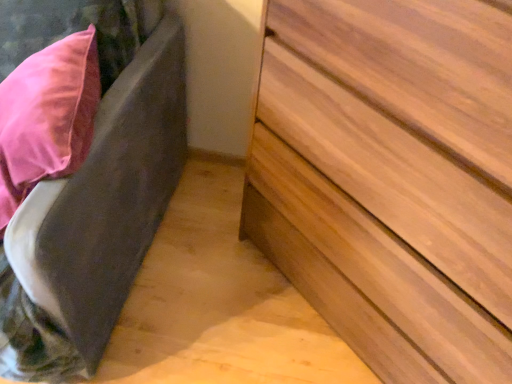
Image resolution: width=512 pixels, height=384 pixels. What do you see at coordinates (96, 209) in the screenshot?
I see `velvet gray bed frame at left` at bounding box center [96, 209].

Locate an element on the screen. velvet gray bed frame at left is located at coordinates (96, 209).

At what (x,y) coordinates should I click in order to perform the action: click on light brown wood chest of drawers at lower right. Please return your answer as a coordinate pair (x, y). The width and height of the screenshot is (512, 384). Looking at the image, I should click on (391, 179).

Measure the distance between light brown wood chest of drawers at lower right and camera.

20.68 inches.

Image resolution: width=512 pixels, height=384 pixels. Describe the element at coordinates (391, 179) in the screenshot. I see `light brown wood chest of drawers at lower right` at that location.

What is the approximate height of light brown wood chest of drawers at lower right?

light brown wood chest of drawers at lower right is 38.69 inches tall.

The width and height of the screenshot is (512, 384). What are the coordinates of `velvet gray bed frame at left` in the screenshot? It's located at (96, 209).

Visually, is velvet gray bed frame at left positioned to the left or to the right of light brown wood chest of drawers at lower right?

velvet gray bed frame at left is to the left of light brown wood chest of drawers at lower right.

In the scene shown: Which object is closer to the camera taking this photo, velvet gray bed frame at left or light brown wood chest of drawers at lower right?

Positioned in front is light brown wood chest of drawers at lower right.

Which is less distant, (64, 339) or (414, 290)?

Point (414, 290)

From the image's perspective, which is above, velvet gray bed frame at left or light brown wood chest of drawers at lower right?

velvet gray bed frame at left, from the image's perspective.

From a real-world perspective, does velvet gray bed frame at left sit lower than light brown wood chest of drawers at lower right?

Yes, from a real-world perspective, velvet gray bed frame at left is below light brown wood chest of drawers at lower right.

Between velvet gray bed frame at left and light brown wood chest of drawers at lower right, which one has larger width?

Wider between the two is velvet gray bed frame at left.

Considering the sizes of velvet gray bed frame at left and light brown wood chest of drawers at lower right in the image, is velvet gray bed frame at left taller or shorter than light brown wood chest of drawers at lower right?

Clearly, velvet gray bed frame at left is shorter compared to light brown wood chest of drawers at lower right.

Can you confirm if velvet gray bed frame at left is smaller than light brown wood chest of drawers at lower right?

Incorrect, velvet gray bed frame at left is not smaller in size than light brown wood chest of drawers at lower right.

Do you think velvet gray bed frame at left is within light brown wood chest of drawers at lower right, or outside of it?

velvet gray bed frame at left cannot be found inside light brown wood chest of drawers at lower right.

Are velvet gray bed frame at left and light brown wood chest of drawers at lower right located far from each other?

No, there isn't a large distance between velvet gray bed frame at left and light brown wood chest of drawers at lower right.

Looking at this image, is velvet gray bed frame at left oriented away from light brown wood chest of drawers at lower right?

That's not correct — velvet gray bed frame at left is not looking away from light brown wood chest of drawers at lower right.

How many degrees apart are the facing directions of velvet gray bed frame at left and light brown wood chest of drawers at lower right?

42.8 degrees separate the facing orientations of velvet gray bed frame at left and light brown wood chest of drawers at lower right.

I want to click on the chest of drawers located below the velvet gray bed frame at left (from the image's perspective), so click(391, 179).

Based on their positions, is light brown wood chest of drawers at lower right located to the left or right of velvet gray bed frame at left?

light brown wood chest of drawers at lower right is to the right of velvet gray bed frame at left.

In the image, is light brown wood chest of drawers at lower right positioned in front of or behind velvet gray bed frame at left?

light brown wood chest of drawers at lower right is in front of velvet gray bed frame at left.

Is point (398, 112) closer to camera compared to point (22, 320)?

Yes, point (398, 112) is closer to viewer.

From the image's perspective, is light brown wood chest of drawers at lower right under velvet gray bed frame at left?

Yes, from the image's perspective, light brown wood chest of drawers at lower right is below velvet gray bed frame at left.

From the picture: From a real-world perspective, does light brown wood chest of drawers at lower right stand above velvet gray bed frame at left?

Indeed, from a real-world perspective, light brown wood chest of drawers at lower right stands above velvet gray bed frame at left.

From the picture: Considering the relative sizes of light brown wood chest of drawers at lower right and velvet gray bed frame at left in the image provided, is light brown wood chest of drawers at lower right thinner than velvet gray bed frame at left?

Yes.

Who is shorter, light brown wood chest of drawers at lower right or velvet gray bed frame at left?

Standing shorter between the two is velvet gray bed frame at left.

Based on their sizes in the image, would you say light brown wood chest of drawers at lower right is bigger or smaller than velvet gray bed frame at left?

Considering their sizes, light brown wood chest of drawers at lower right takes up less space than velvet gray bed frame at left.

Which is correct: light brown wood chest of drawers at lower right is inside velvet gray bed frame at left, or outside of it?

The correct answer is: outside.

Are light brown wood chest of drawers at lower right and velvet gray bed frame at left beside each other?

light brown wood chest of drawers at lower right is not next to velvet gray bed frame at left, and they're not touching.

Is light brown wood chest of drawers at lower right turned away from velvet gray bed frame at left?

That's not correct — light brown wood chest of drawers at lower right is not looking away from velvet gray bed frame at left.

How different are the orientations of light brown wood chest of drawers at lower right and velvet gray bed frame at left in degrees?

42.8 degrees separate the facing orientations of light brown wood chest of drawers at lower right and velvet gray bed frame at left.

Image resolution: width=512 pixels, height=384 pixels. In order to click on the chest of drawers in front of the velvet gray bed frame at left in this screenshot , I will do `click(391, 179)`.

Where is `chest of drawers lying on the right of velvet gray bed frame at left`? The height and width of the screenshot is (384, 512). chest of drawers lying on the right of velvet gray bed frame at left is located at coordinates pos(391,179).

Image resolution: width=512 pixels, height=384 pixels. Find the location of `chest of drawers in front of the velvet gray bed frame at left`. chest of drawers in front of the velvet gray bed frame at left is located at coordinates (391, 179).